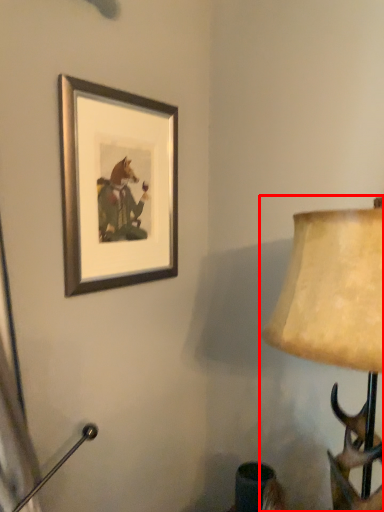
Question: From the image, what is the correct spatial relationship of lamp (annotated by the red box) in relation to picture frame?

Choices:
 (A) right
 (B) left

Answer: (A)